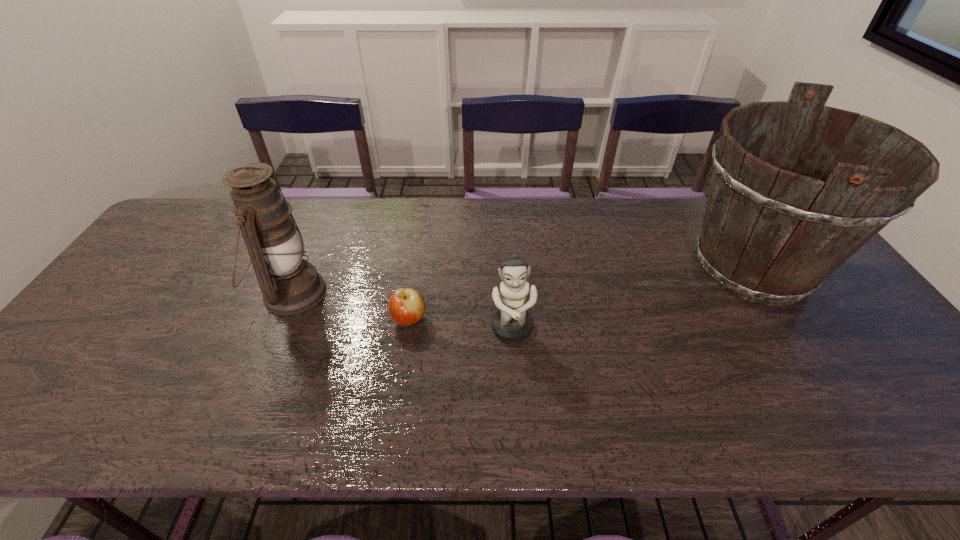
Find the location of a particular element. This screenshot has width=960, height=540. free region located 0.360m on the right of the second object from left to right is located at coordinates (566, 320).

This screenshot has width=960, height=540. Identify the location of object that is at the far edge. (776, 225).

Locate an element on the screen. This screenshot has height=540, width=960. object positioned at the right edge is located at coordinates (776, 225).

The width and height of the screenshot is (960, 540). I want to click on object situated at the far right corner, so click(776, 225).

The image size is (960, 540). In the image, there is a desktop. What are the coordinates of `vacant space at the far edge` in the screenshot? It's located at (473, 242).

At what (x,y) coordinates should I click in order to perform the action: click on vacant area at the near edge. Please return your answer as a coordinate pair (x, y). This screenshot has width=960, height=540. Looking at the image, I should click on (275, 418).

Where is `vacant space at the right edge`? The image size is (960, 540). vacant space at the right edge is located at coordinates (853, 380).

Identify the location of blank space at the far left corner of the desktop. (191, 206).

Identify the location of free point between the shortest object and the second tallest object. This screenshot has height=540, width=960. (350, 306).

Where is `free spot between the oil lamp and the shortest object`? This screenshot has height=540, width=960. free spot between the oil lamp and the shortest object is located at coordinates (350, 306).